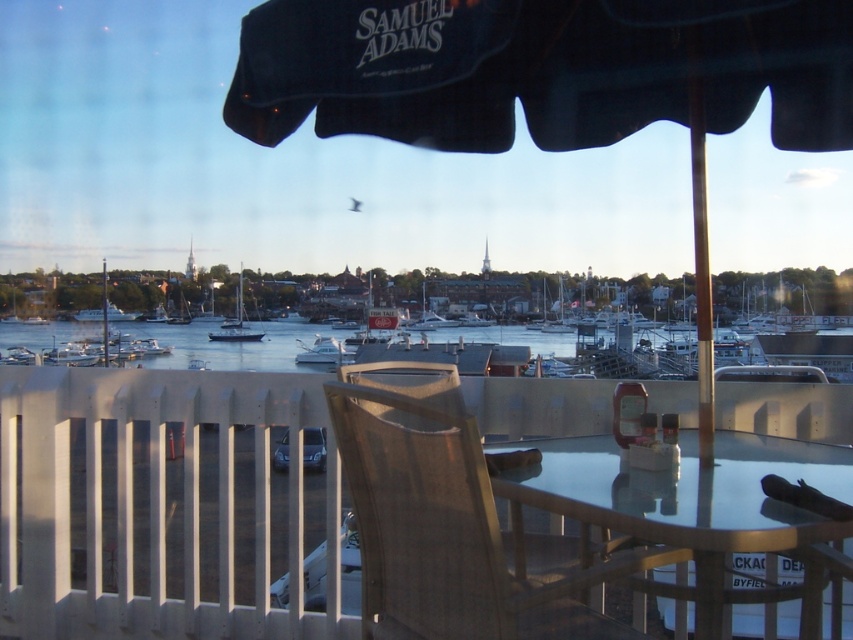
Is sandy beige fabric chair at center positioned before white matte sailboat at center?

Yes, it is in front of white matte sailboat at center.

Between sandy beige fabric chair at center and white matte sailboat at center, which one appears on the left side from the viewer's perspective?

white matte sailboat at center is more to the left.

Who is more distant from viewer, (432,509) or (260,332)?

The point (260,332) is more distant.

In order to click on sandy beige fabric chair at center in this screenshot , I will do `click(436, 529)`.

Does wooden railing at lower center have a greater width compared to white matte sailboat at center?

Yes, wooden railing at lower center is wider than white matte sailboat at center.

Who is shorter, wooden railing at lower center or white matte sailboat at center?

white matte sailboat at center is shorter.

Between point (828, 538) and point (229, 330), which one is positioned behind?

The point (229, 330) is more distant.

Where is `wooden railing at lower center`? The height and width of the screenshot is (640, 853). wooden railing at lower center is located at coordinates (399, 506).

Can you confirm if wooden railing at lower center is shorter than sandy beige fabric chair at center?

Incorrect, wooden railing at lower center's height does not fall short of sandy beige fabric chair at center's.

In the scene shown: Does wooden railing at lower center lie behind sandy beige fabric chair at center?

No, wooden railing at lower center is closer to the viewer.

Describe the element at coordinates (399, 506) in the screenshot. I see `wooden railing at lower center` at that location.

Find the location of a particular element. This screenshot has height=640, width=853. wooden railing at lower center is located at coordinates (399, 506).